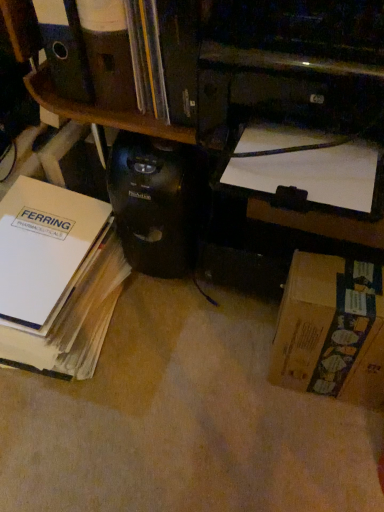
Question: Is black plastic printer at upper center oriented towards brown cardboard box at lower right?

Choices:
 (A) no
 (B) yes

Answer: (A)

Question: Can you confirm if black plastic printer at upper center is smaller than brown cardboard box at lower right?

Choices:
 (A) yes
 (B) no

Answer: (B)

Question: Considering the relative sizes of black plastic printer at upper center and brown cardboard box at lower right in the image provided, is black plastic printer at upper center shorter than brown cardboard box at lower right?

Choices:
 (A) no
 (B) yes

Answer: (B)

Question: Is black plastic printer at upper center taller than brown cardboard box at lower right?

Choices:
 (A) no
 (B) yes

Answer: (A)

Question: Does black plastic printer at upper center have a lesser width compared to brown cardboard box at lower right?

Choices:
 (A) yes
 (B) no

Answer: (B)

Question: Is black plastic printer at upper center not within brown cardboard box at lower right?

Choices:
 (A) no
 (B) yes

Answer: (B)

Question: Would you say black plastic computer tower at center contains white paper at upper right, which ranks as the 2th book in left-to-right order?

Choices:
 (A) no
 (B) yes

Answer: (A)

Question: From a real-world perspective, is black plastic computer tower at center over white paper at upper right, which is the first book in right-to-left order?

Choices:
 (A) no
 (B) yes

Answer: (A)

Question: Does black plastic computer tower at center have a lesser width compared to white paper at upper right, which ranks as the 2th book in left-to-right order?

Choices:
 (A) yes
 (B) no

Answer: (B)

Question: Is the depth of black plastic computer tower at center greater than that of white paper at upper right, which ranks as the 2th book in left-to-right order?

Choices:
 (A) yes
 (B) no

Answer: (A)

Question: Is white paper at upper right, which is the first book in right-to-left order, at the back of black plastic computer tower at center?

Choices:
 (A) no
 (B) yes

Answer: (A)

Question: Can you confirm if black plastic computer tower at center is wider than white paper at upper right, which ranks as the 2th book in left-to-right order?

Choices:
 (A) yes
 (B) no

Answer: (A)

Question: Is white paper at upper right, which is the first book in right-to-left order, located outside brown cardboard box at lower right?

Choices:
 (A) no
 (B) yes

Answer: (B)